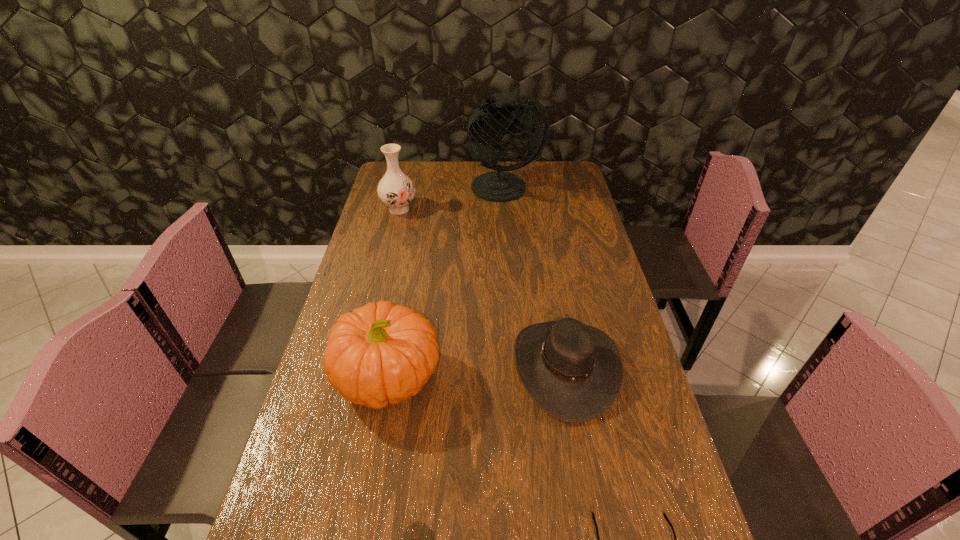
Locate an element on the screen. This screenshot has height=540, width=960. blank region between the pumpkin and the vase is located at coordinates (395, 293).

The image size is (960, 540). I want to click on vacant point located between the tallest object and the pumpkin, so click(448, 282).

The width and height of the screenshot is (960, 540). Find the location of `vacant area that lies between the cowboy hat and the globe`. vacant area that lies between the cowboy hat and the globe is located at coordinates (536, 278).

Identify the location of object identified as the fourth closest to the pumpkin. (396, 190).

Locate an element on the screen. object that is the second nearest to the sunglasses is located at coordinates (412, 539).